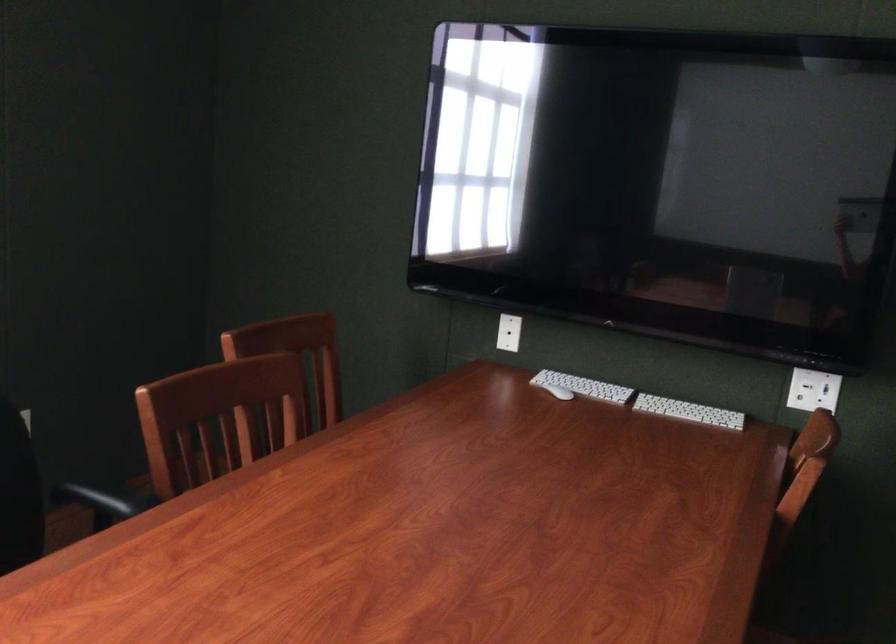
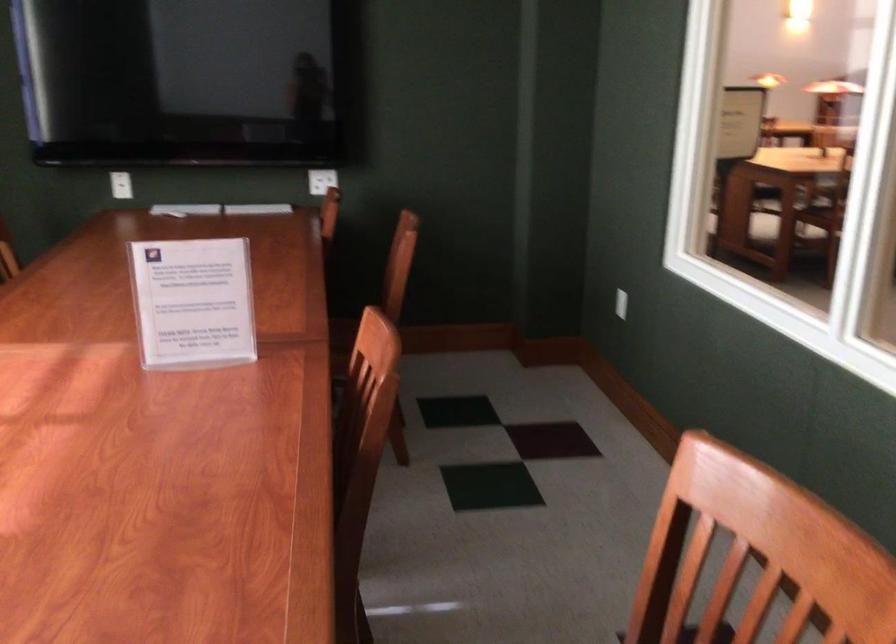
Locate, in the second image, the point that corresponds to point 496,337 in the first image.

(121, 185)